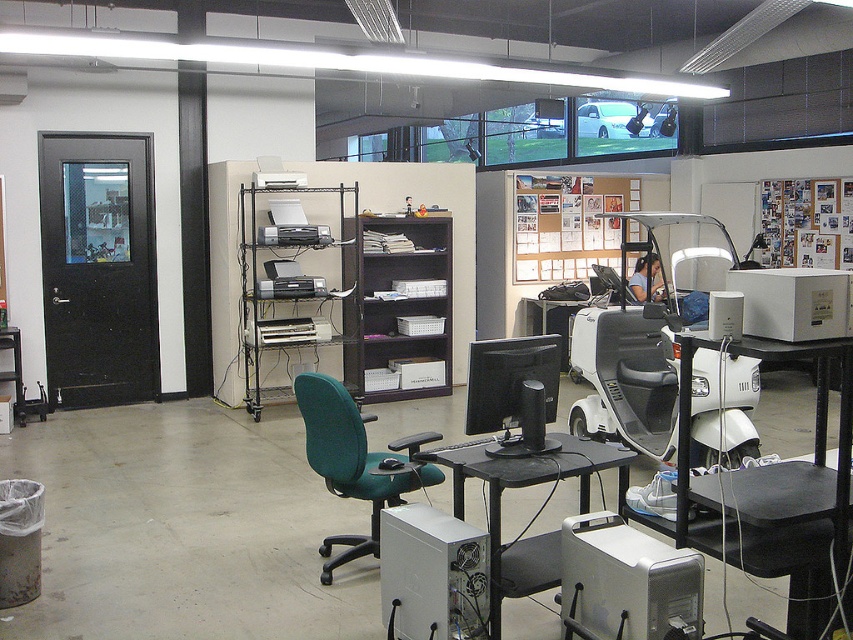
Where is `black plastic computer desk at center`? This screenshot has width=853, height=640. black plastic computer desk at center is located at coordinates (779, 461).

In the scene shown: Between black plastic computer desk at center and black glossy monitor at center, which one is positioned higher?

Positioned higher is black glossy monitor at center.

Is point (842, 518) farther from camera compared to point (524, 420)?

No.

In order to click on black plastic computer desk at center in this screenshot , I will do `click(779, 461)`.

Is white plastic desktop computer at center wider than black glossy monitor at center?

Correct, the width of white plastic desktop computer at center exceeds that of black glossy monitor at center.

Which is behind, point (465, 568) or point (544, 346)?

The point (544, 346) is behind.

Image resolution: width=853 pixels, height=640 pixels. Find the location of `white plastic desktop computer at center`. white plastic desktop computer at center is located at coordinates (432, 573).

Looking at this image, is black plastic computer desk at center to the left of white plastic desktop computer at center from the viewer's perspective?

Incorrect, black plastic computer desk at center is not on the left side of white plastic desktop computer at center.

Between point (814, 493) and point (460, 637), which one is positioned in front?

Point (814, 493) is more forward.

Locate an element on the screen. The image size is (853, 640). black plastic computer desk at center is located at coordinates (779, 461).